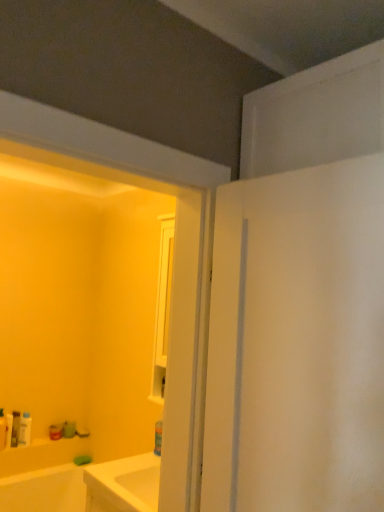
Question: Is white plastic bottle at lower left, the 2th toiletry in the right-to-left sequence, thinner than matte white tube at lower left, the fourth toiletry from the right?

Choices:
 (A) yes
 (B) no

Answer: (B)

Question: Is white plastic bottle at lower left, the fourth toiletry when ordered from left to right, turned away from matte white tube at lower left, the fourth toiletry from the right?

Choices:
 (A) yes
 (B) no

Answer: (B)

Question: From a real-world perspective, is white plastic bottle at lower left, the fourth toiletry when ordered from left to right, physically below matte white tube at lower left, the fourth toiletry from the right?

Choices:
 (A) no
 (B) yes

Answer: (A)

Question: Is white plastic bottle at lower left, the 2th toiletry in the right-to-left sequence, facing towards matte white tube at lower left, the second toiletry in the left-to-right sequence?

Choices:
 (A) no
 (B) yes

Answer: (A)

Question: Would you say matte white tube at lower left, the second toiletry in the left-to-right sequence, is part of white plastic bottle at lower left, the fourth toiletry when ordered from left to right,'s contents?

Choices:
 (A) yes
 (B) no

Answer: (B)

Question: Is white plastic bottle at lower left, the fourth toiletry when ordered from left to right, not near matte white tube at lower left, the second toiletry in the left-to-right sequence?

Choices:
 (A) no
 (B) yes

Answer: (A)

Question: Does matte green soap at lower left, the fifth toiletry viewed from the left, have a greater width compared to white plastic bottle at lower left, the 3th toiletry from the right?

Choices:
 (A) yes
 (B) no

Answer: (A)

Question: From the image's perspective, is matte green soap at lower left, the fifth toiletry viewed from the left, on white plastic bottle at lower left, positioned as the 3th toiletry in left-to-right order?

Choices:
 (A) no
 (B) yes

Answer: (A)

Question: Is matte green soap at lower left, the fifth toiletry viewed from the left, positioned with its back to white plastic bottle at lower left, the 3th toiletry from the right?

Choices:
 (A) no
 (B) yes

Answer: (A)

Question: Is matte green soap at lower left, the fifth toiletry viewed from the left, to the left of white plastic bottle at lower left, the 3th toiletry from the right, from the viewer's perspective?

Choices:
 (A) no
 (B) yes

Answer: (A)

Question: Does matte green soap at lower left, positioned as the first toiletry in right-to-left order, have a smaller size compared to white plastic bottle at lower left, positioned as the 3th toiletry in left-to-right order?

Choices:
 (A) yes
 (B) no

Answer: (B)

Question: Considering the relative positions of matte green soap at lower left, positioned as the first toiletry in right-to-left order, and white plastic bottle at lower left, the 3th toiletry from the right, in the image provided, is matte green soap at lower left, positioned as the first toiletry in right-to-left order, to the right of white plastic bottle at lower left, the 3th toiletry from the right, from the viewer's perspective?

Choices:
 (A) yes
 (B) no

Answer: (A)

Question: Is white plastic bottle at lower left, positioned as the 3th toiletry in left-to-right order, aimed at matte white bottle at lower left, which ranks as the 5th toiletry in right-to-left order?

Choices:
 (A) no
 (B) yes

Answer: (A)